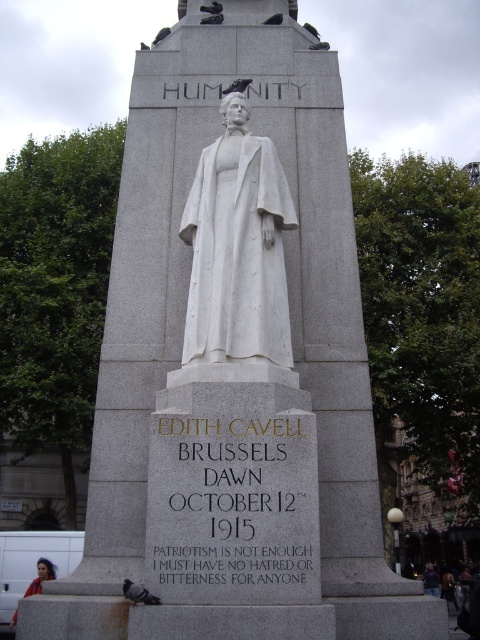
You are a tour guide explaining the monument to visitors. You notice a red jacket at lower left and a gray matte pigeon at upper center in the image. Which object is located to the left of the other?

The red jacket at lower left is positioned on the left side of gray matte pigeon at upper center.

You are standing in front of the monument and notice two points marked on the base. The first point is at coordinates point [157,600] and the second is at point [274,20]. Which point is closer to you?

Point [157,600] is in front of point [274,20], so it is closer to you.